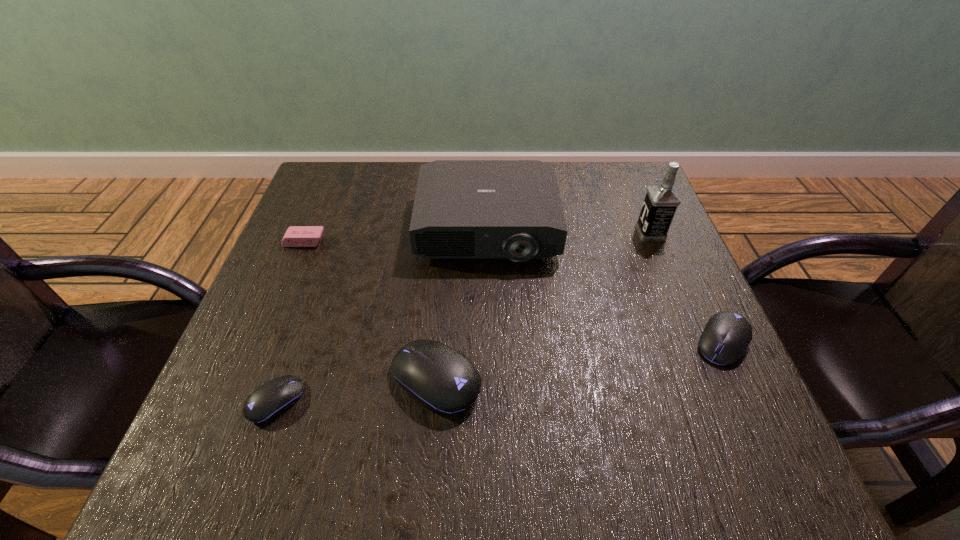
Identify the location of vodka that is at the right edge. (661, 201).

In order to click on object at the near left corner in this screenshot , I will do `click(270, 400)`.

In the image, there is a desktop. Where is `blank space at the far edge`? blank space at the far edge is located at coordinates (570, 207).

Find the location of `vacant space at the near edge of the desktop`. vacant space at the near edge of the desktop is located at coordinates (493, 385).

This screenshot has width=960, height=540. In order to click on free space at the right edge of the desktop in this screenshot , I will do `click(695, 293)`.

Where is `vacant area at the far left corner`? vacant area at the far left corner is located at coordinates (352, 198).

In the image, there is a desktop. Where is `vacant space at the near left corner`? The image size is (960, 540). vacant space at the near left corner is located at coordinates (220, 402).

You are a GUI agent. You are given a task and a screenshot of the screen. Output one action in this format:
    pyautogui.click(x=<x>, y=<y>)
    Task: Click on the vacant space at the near right corner
    
    Given the screenshot: What is the action you would take?
    pyautogui.click(x=752, y=414)

Where is `free spot between the eraser and the second tallest object`? The image size is (960, 540). free spot between the eraser and the second tallest object is located at coordinates (396, 235).

Find the location of `free area in between the eraser and the second tallest object`. free area in between the eraser and the second tallest object is located at coordinates pos(396,235).